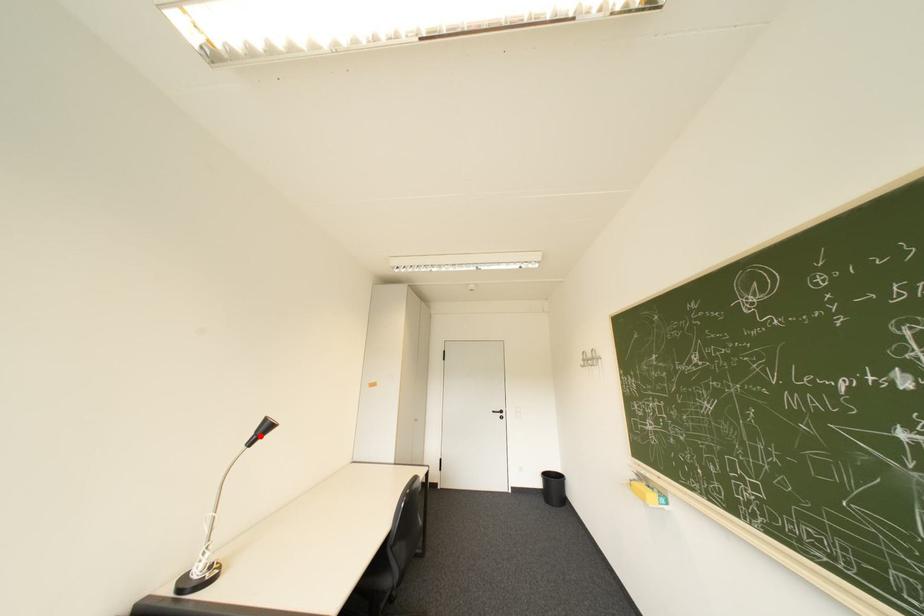
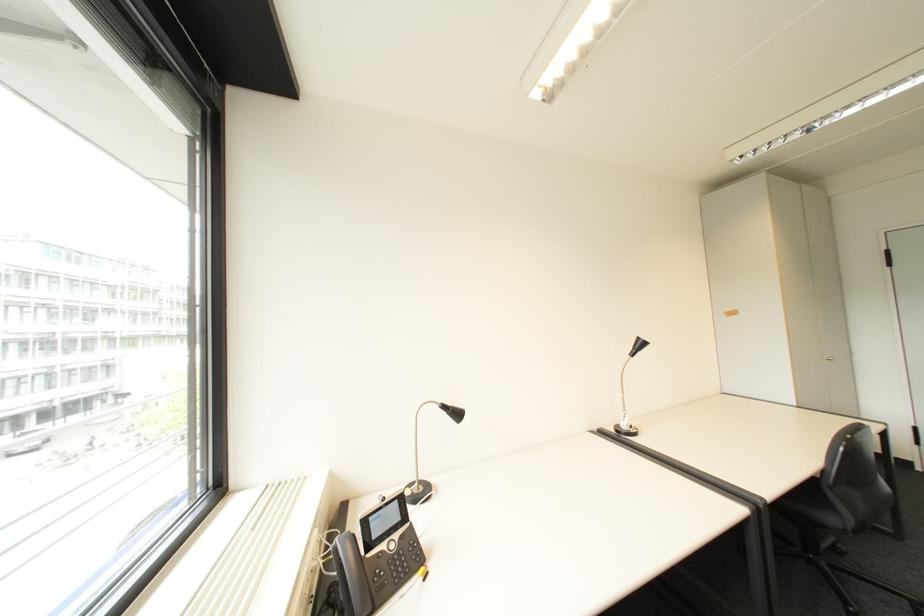
Find the pixel in the second image that matches the highlighted location in the first image.

(640, 350)